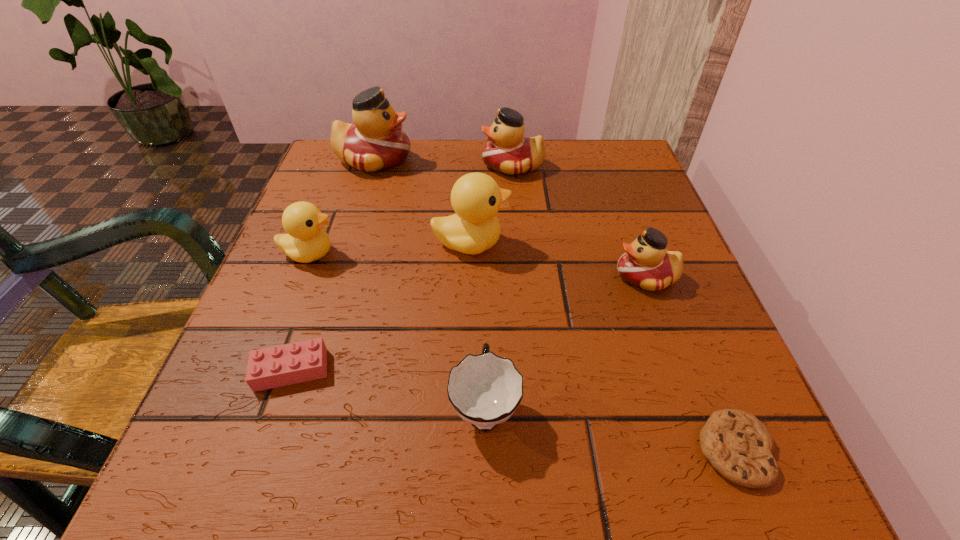
You are a GUI agent. You are given a task and a screenshot of the screen. Output one action in this format:
    pyautogui.click(x=<x>, y=<y>)
    Task: Click on the free space located 0.400m on the face of the rightmost duck
    This screenshot has width=960, height=540.
    Given the screenshot: What is the action you would take?
    pyautogui.click(x=384, y=276)

Locate an element on the screen. free space located 0.280m on the side of the white cup with the handle is located at coordinates (484, 240).

Locate an element on the screen. The height and width of the screenshot is (540, 960). free space located 0.380m on the side of the white cup with the handle is located at coordinates (483, 208).

Identify the location of vacant space located on the side of the white cup with the handle. (484, 329).

Where is `vacant space situated on the right of the pink Lego`? This screenshot has width=960, height=540. vacant space situated on the right of the pink Lego is located at coordinates (565, 370).

The image size is (960, 540). In order to click on free spot located on the left of the brown cookie in this screenshot , I will do `click(404, 450)`.

Where is `cup located at the near edge`? Image resolution: width=960 pixels, height=540 pixels. cup located at the near edge is located at coordinates (485, 390).

At what (x,y) coordinates should I click in order to perform the action: click on cookie present at the near edge. Please return your answer as a coordinate pair (x, y). This screenshot has height=540, width=960. Looking at the image, I should click on (737, 444).

Where is `Lego situated at the left edge`? The width and height of the screenshot is (960, 540). Lego situated at the left edge is located at coordinates (x=303, y=361).

The image size is (960, 540). What are the coordinates of `duck situated at the right edge` in the screenshot? It's located at (646, 264).